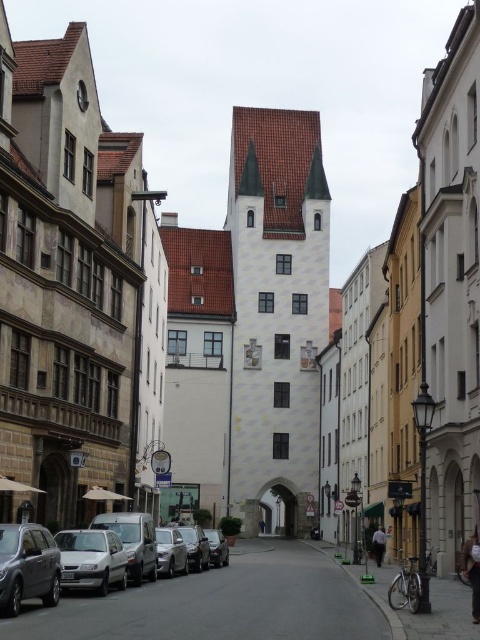
You are a tourist standing on the narrow street in the historic European city. You see a satin silver car at center and a dark blue jeans at center. Which object is larger in size?

The dark blue jeans at center is larger than the satin silver car at center.

Based on the photo, you are driving a car that is 5 meters long. You are currently parked at the metallic gray suv at lower left and want to move your car to the satin silver car at center. Is there enough space between them to safely move your car without needing to back up?

The metallic gray suv at lower left and satin silver car at center are 16.15 meters apart from each other. Since your car is only 5 meters long, there is sufficient space between them to safely move your car without needing to back up.